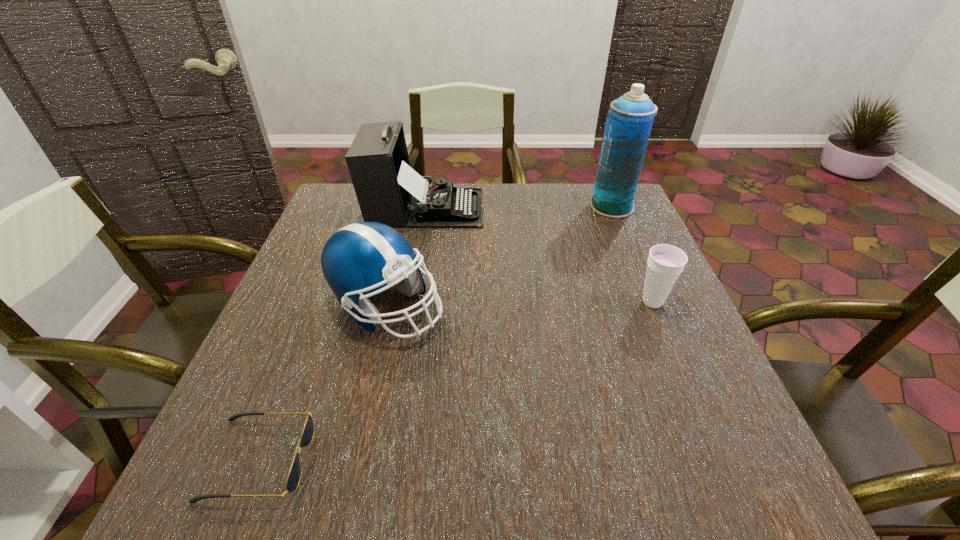
Locate an element on the screen. object at the near left corner is located at coordinates coord(293,479).

You are a GUI agent. You are given a task and a screenshot of the screen. Output one action in this format:
    pyautogui.click(x=<x>, y=<y>)
    Task: Click on the object that is positioned at the far right corner
    
    Given the screenshot: What is the action you would take?
    pyautogui.click(x=629, y=120)

I want to click on vacant region at the far edge of the desktop, so click(x=555, y=204).

Image resolution: width=960 pixels, height=540 pixels. In order to click on free space at the left edge of the desktop in this screenshot , I will do coord(327,370).

In the image, there is a desktop. Identify the location of free region at the right edge. (688, 426).

Find the location of `vacant space at the far left corner of the desktop`. vacant space at the far left corner of the desktop is located at coordinates (341, 191).

In order to click on free space at the far right corner in this screenshot , I will do `click(580, 185)`.

This screenshot has width=960, height=540. I want to click on vacant space that is in between the shortest object and the third shortest object, so (323, 383).

You are a GUI agent. You are given a task and a screenshot of the screen. Output one action in this format:
    pyautogui.click(x=<x>, y=<y>)
    Task: Click on the free space between the shortest object and the fourth tallest object
    Image resolution: width=960 pixels, height=540 pixels.
    Given the screenshot: What is the action you would take?
    pyautogui.click(x=456, y=381)

This screenshot has height=540, width=960. Find the location of `free area in between the aerosol can and the second tallest object`. free area in between the aerosol can and the second tallest object is located at coordinates (518, 207).